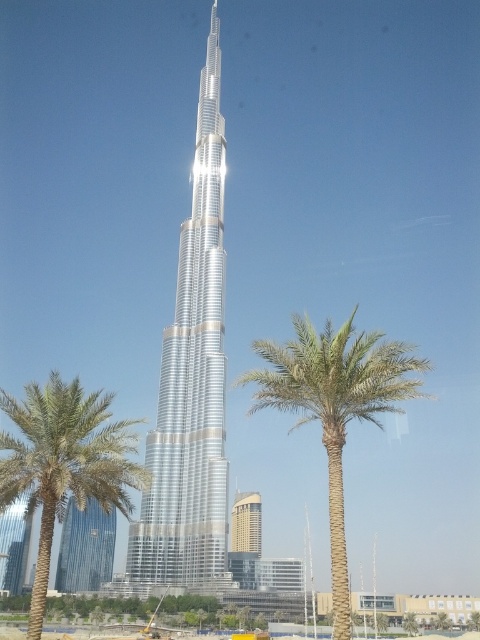
Between silver metallic tower at center and green leafy palm at center, which one is positioned higher?

silver metallic tower at center is above.

Is point (148, 490) positioned in front of point (380, 376)?

No, (148, 490) is behind (380, 376).

Where is `silver metallic tower at center`? The height and width of the screenshot is (640, 480). silver metallic tower at center is located at coordinates (191, 381).

In the scene shown: Who is more forward, [384,342] or [232,541]?

Positioned in front is point [384,342].

Between green leafy palm at center and gold metallic building at center, which one has less height?

gold metallic building at center

What do you see at coordinates (335, 406) in the screenshot?
I see `green leafy palm at center` at bounding box center [335, 406].

This screenshot has height=640, width=480. I want to click on green leafy palm at center, so pos(335,406).

Who is higher up, green leafy palm tree at center or gold metallic building at center?

green leafy palm tree at center is above.

Does green leafy palm tree at center lie behind gold metallic building at center?

No, green leafy palm tree at center is closer to the viewer.

I want to click on green leafy palm tree at center, so click(x=64, y=461).